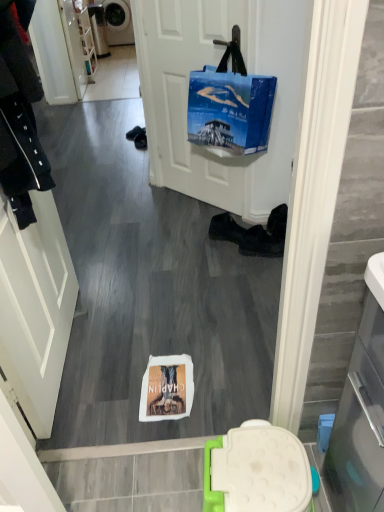
I want to click on vacant space that's between black leather shoe at lower center and white paper bag at center, so click(x=213, y=309).